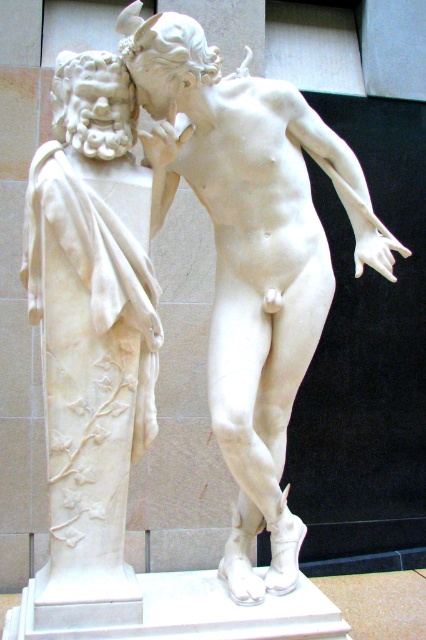
Where is the white marble statue at center located in the image?

The white marble statue at center is located at point (250,257).

Based on the photo, you are an art curator planning to display both the white marble statue at center and the white marble statue at left in a gallery. Given their widths, which statue requires more horizontal space for proper display?

The white marble statue at center requires more horizontal space because its width surpasses that of the white marble statue at left.

You are a tour guide standing in front of the white marble statue at center. You need to ensure that visitors maintain a safe distance of at least 2 meters from the statue to prevent damage. A visitor approaches and stands 1.5 meters away from the statue. What should you do?

The visitor is standing 1.5 meters away from the white marble statue at center, which is closer than the required 2 meters. You should politely ask them to move back to maintain the safe distance of at least 2 meters.